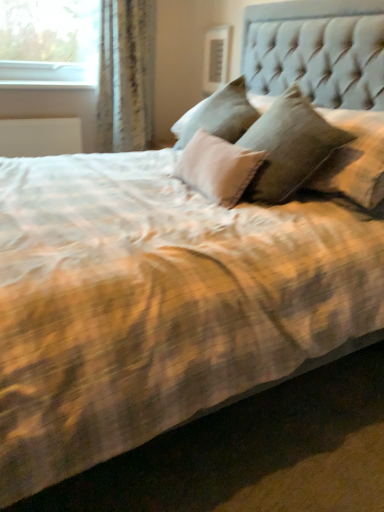
Question: From a real-world perspective, is white textured curtain at upper left above or below white plastic window sill at upper left?

Choices:
 (A) below
 (B) above

Answer: (A)

Question: Is white textured curtain at upper left inside the boundaries of white plastic window sill at upper left, or outside?

Choices:
 (A) inside
 (B) outside

Answer: (B)

Question: Would you say white textured curtain at upper left is to the left or to the right of white plastic window sill at upper left in the picture?

Choices:
 (A) left
 (B) right

Answer: (B)

Question: Is white plastic window sill at upper left in front of or behind white textured curtain at upper left in the image?

Choices:
 (A) behind
 (B) front

Answer: (A)

Question: Is point (36, 81) closer or farther from the camera than point (100, 10)?

Choices:
 (A) farther
 (B) closer

Answer: (A)

Question: From a real-world perspective, is white plastic window sill at upper left physically located above or below white textured curtain at upper left?

Choices:
 (A) above
 (B) below

Answer: (A)

Question: In the image, is white plastic window sill at upper left on the left side or the right side of white textured curtain at upper left?

Choices:
 (A) right
 (B) left

Answer: (B)